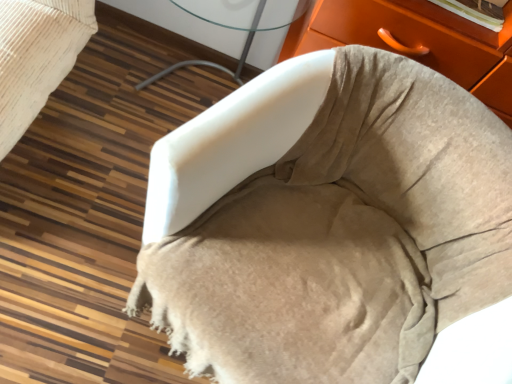
Question: Should I look upward or downward to see white glass table at center?

Choices:
 (A) down
 (B) up

Answer: (B)

Question: Does white glass table at center lie behind beige suede chair at center?

Choices:
 (A) yes
 (B) no

Answer: (A)

Question: Can beige suede chair at center be found inside white glass table at center?

Choices:
 (A) yes
 (B) no

Answer: (B)

Question: Is white glass table at center outside of beige suede chair at center?

Choices:
 (A) no
 (B) yes

Answer: (B)

Question: Is white glass table at center facing away from beige suede chair at center?

Choices:
 (A) no
 (B) yes

Answer: (A)

Question: Is white glass table at center oriented towards beige suede chair at center?

Choices:
 (A) yes
 (B) no

Answer: (B)

Question: Is white glass table at center wider than beige suede chair at center?

Choices:
 (A) no
 (B) yes

Answer: (A)

Question: Does beige suede chair at center have a lesser height compared to white glass table at center?

Choices:
 (A) no
 (B) yes

Answer: (B)

Question: Can you confirm if beige suede chair at center is positioned to the left of white glass table at center?

Choices:
 (A) no
 (B) yes

Answer: (A)

Question: Can you confirm if beige suede chair at center is wider than white glass table at center?

Choices:
 (A) yes
 (B) no

Answer: (A)

Question: Are beige suede chair at center and white glass table at center making contact?

Choices:
 (A) no
 (B) yes

Answer: (A)

Question: Is beige suede chair at center facing towards white glass table at center?

Choices:
 (A) yes
 (B) no

Answer: (B)

Question: Is beige suede chair at center smaller than white glass table at center?

Choices:
 (A) yes
 (B) no

Answer: (B)

Question: From a real-world perspective, is white glass table at center above or below beige suede chair at center?

Choices:
 (A) above
 (B) below

Answer: (B)